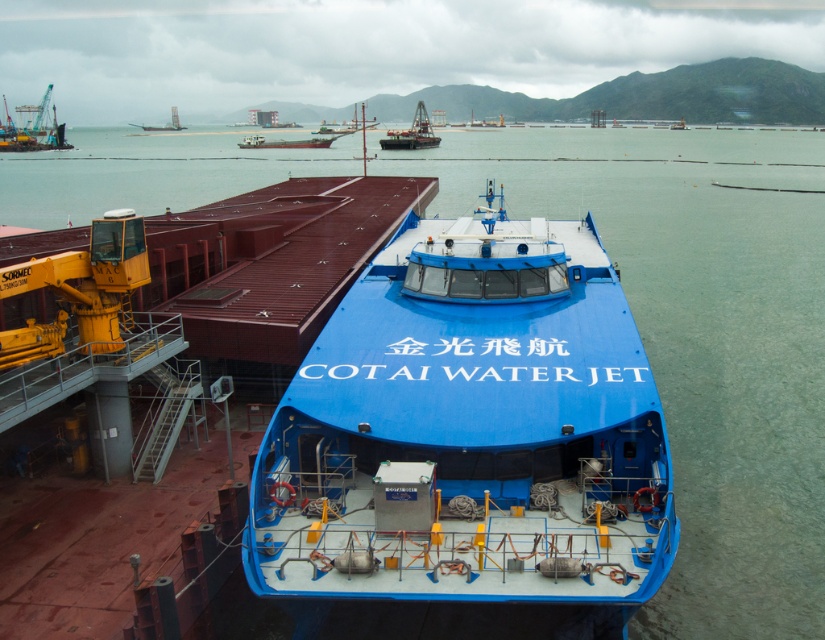
You are a harbor worker who needs to load cargo onto both the brown matte boat at center and the metallic gray boat at upper center. Which boat should you start with to ensure you can reach both without moving the crane from its current position?

You should start with the brown matte boat at center because it is positioned under the metallic gray boat at upper center, meaning the crane can reach it first before adjusting for the upper boat.

You are standing on the pier and want to take a photo of the blue matte boat at center. If your camera can focus on objects up to 30 feet away, will you need to move closer to get a clear shot?

The blue matte boat at center is 32.74 feet away from you, which is beyond the camera focus limit of 30 feet. To get a clear photo, you need to move closer so that the distance becomes within 30 feet.

You are a harbor worker who needs to board the blue matte boat at center and the metallic gray boat at upper center. Which boat will require you to climb higher from the dock?

The metallic gray boat at upper center is larger than the blue matte boat at center, so you will need to climb higher to board the metallic gray boat at upper center.